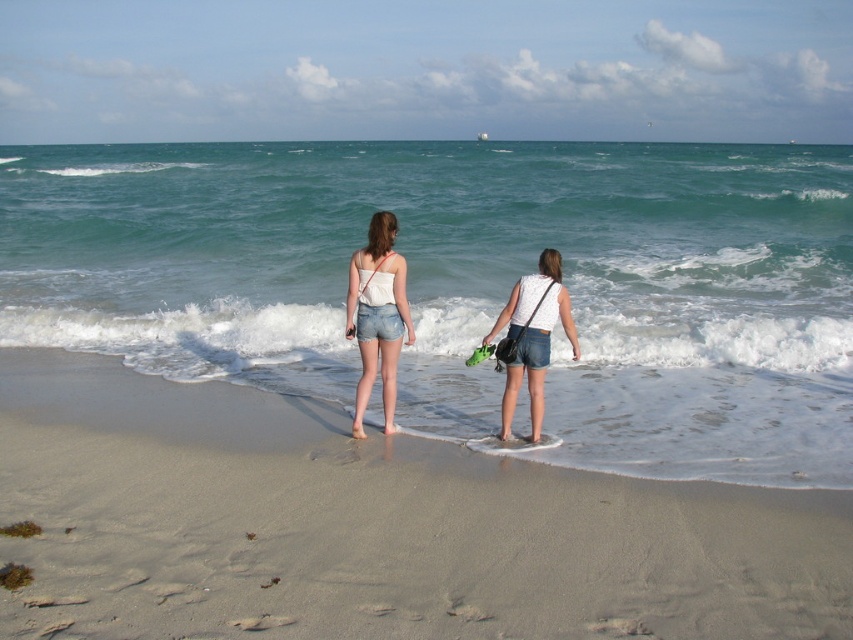
Based on the coordinates provided, where is the matte white tank top at center located in the image?

The matte white tank top at center is located at the coordinates point (376, 316).

You are standing on the beach and want to take a photo of the point at coordinates (374, 280). If your camera has a maximum focus range of 7 meters, will it be able to focus on that point?

The point at coordinates (374, 280) is 7.19 meters away from the camera, which exceeds the maximum focus range of 7 meters. Therefore, the camera cannot focus on that point.

You are standing on the beach and want to walk towards the two points marked in the image. Which point, point [270,620] or point [392,268], will you reach first?

Point [270,620] is closer to the viewer than point [392,268], so you will reach point [270,620] first.